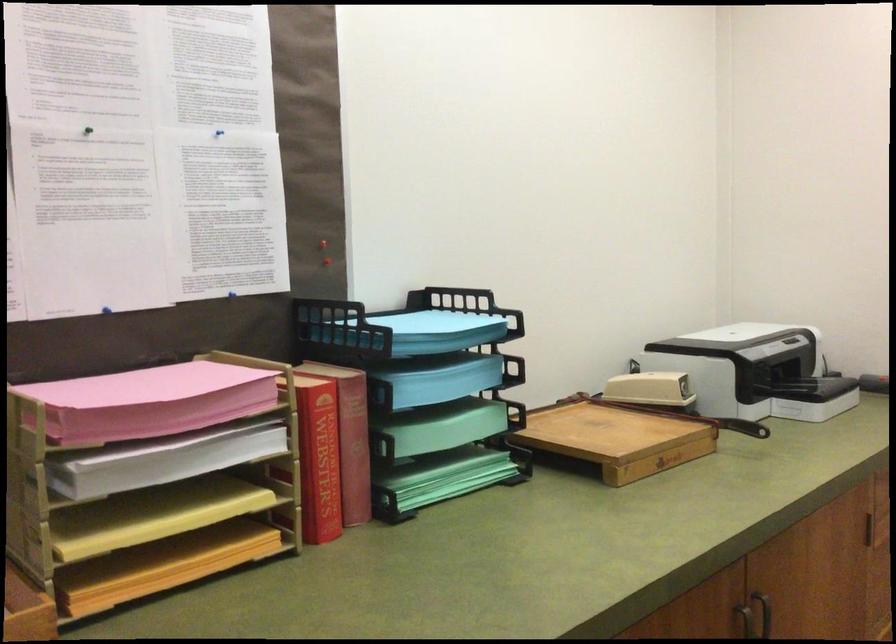
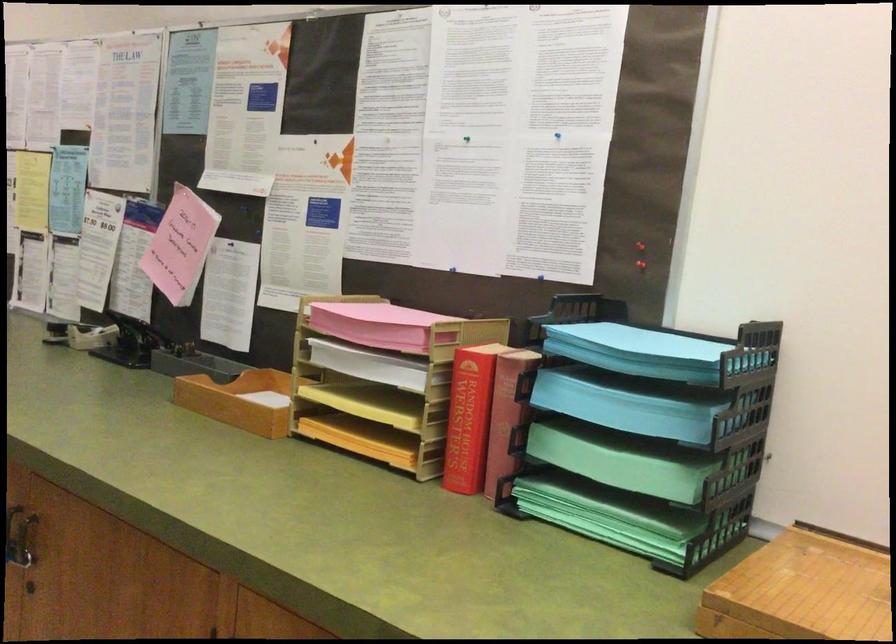
In the second image, find the point that corresponds to [451,333] in the first image.

(640, 352)